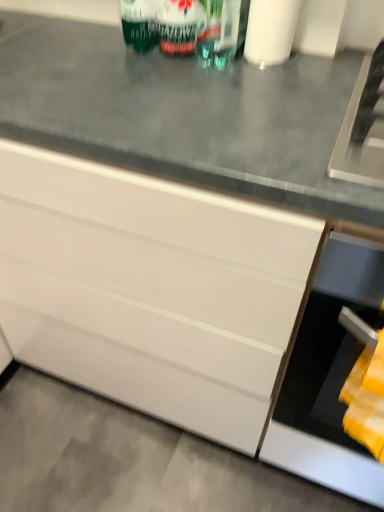
Locate an element on the screen. Image resolution: width=384 pixels, height=512 pixels. vacant region in front of green glass wine bottle at upper center is located at coordinates (218, 96).